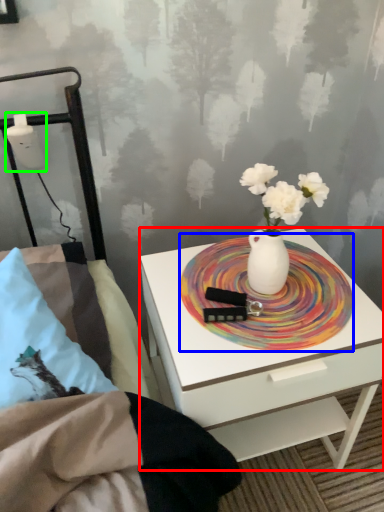
Question: Considering the real-world distances, which object is farthest from nightstand (highlighted by a red box)? platter (highlighted by a blue box) or table lamp (highlighted by a green box)?

Choices:
 (A) platter
 (B) table lamp

Answer: (B)